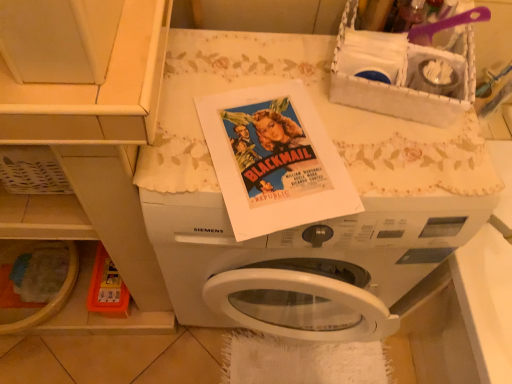
Question: In the image, is white woven basket at upper right positioned in front of or behind white matte washing machine at center?

Choices:
 (A) behind
 (B) front

Answer: (B)

Question: From a real-world perspective, is white woven basket at upper right physically located above or below white matte washing machine at center?

Choices:
 (A) above
 (B) below

Answer: (A)

Question: Is white woven basket at upper right taller or shorter than white matte washing machine at center?

Choices:
 (A) tall
 (B) short

Answer: (B)

Question: In the image, is white matte washing machine at center on the left side or the right side of white woven basket at upper right?

Choices:
 (A) left
 (B) right

Answer: (A)

Question: Is white matte washing machine at center inside or outside of white woven basket at upper right?

Choices:
 (A) inside
 (B) outside

Answer: (B)

Question: From the image's perspective, is white matte washing machine at center above or below white woven basket at upper right?

Choices:
 (A) below
 (B) above

Answer: (A)

Question: Looking at their shapes, would you say white matte washing machine at center is wider or thinner than white woven basket at upper right?

Choices:
 (A) thin
 (B) wide

Answer: (B)